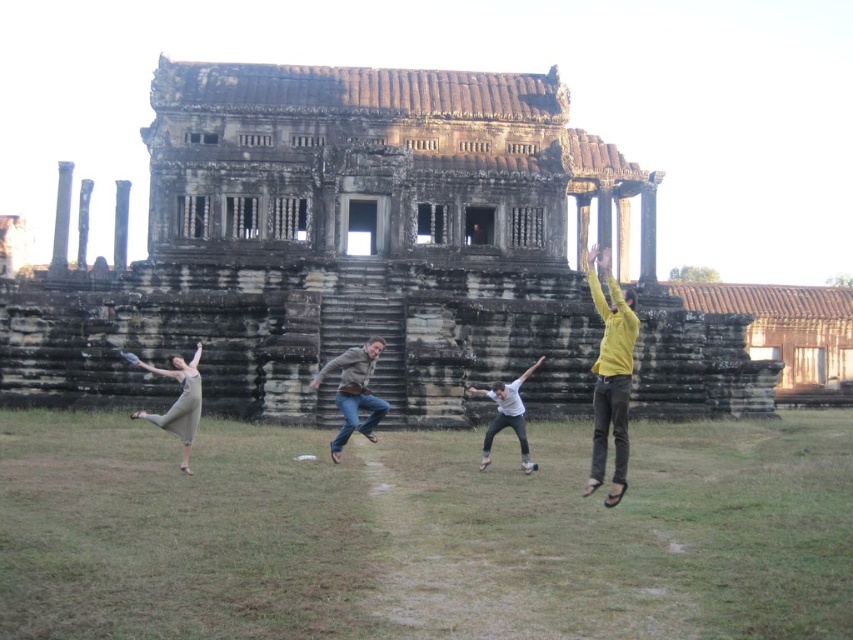
Question: Is weathered stone temple at center positioned at the back of white plastic frisbee at center?

Choices:
 (A) yes
 (B) no

Answer: (A)

Question: Where is brown leather jacket at center located in relation to white plastic frisbee at center in the image?

Choices:
 (A) left
 (B) right

Answer: (B)

Question: Which point is closer to the camera taking this photo?

Choices:
 (A) (604, 355)
 (B) (343, 397)
 (C) (483, 445)
 (D) (135, 356)

Answer: (A)

Question: Which of the following is the closest to the observer?

Choices:
 (A) weathered stone temple at center
 (B) matte beige dress at lower left
 (C) white matte shirt at center
 (D) brown leather jacket at center

Answer: (B)

Question: Is yellow matte shirt at right bigger than matte beige dress at lower left?

Choices:
 (A) no
 (B) yes

Answer: (B)

Question: Considering the real-world distances, which object is closest to the yellow matte shirt at right?

Choices:
 (A) white matte shirt at center
 (B) brown leather jacket at center
 (C) weathered stone temple at center

Answer: (A)